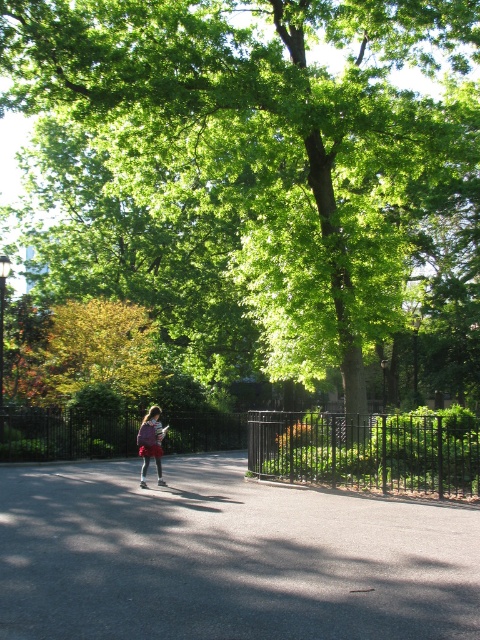
Question: Estimate the real-world distances between objects in this image. Which object is farther from the black rubber skate at center?

Choices:
 (A) green leafy tree at center
 (B) black metal fence at lower center
 (C) matte purple backpack at center

Answer: (A)

Question: Can you confirm if smooth asphalt path at center is positioned to the right of matte purple backpack at center?

Choices:
 (A) no
 (B) yes

Answer: (B)

Question: Among these points, which one is nearest to the camera?

Choices:
 (A) pos(144,481)
 (B) pos(201,225)

Answer: (A)

Question: Is the position of black metal fence at center less distant than that of black rubber skate at center?

Choices:
 (A) yes
 (B) no

Answer: (B)

Question: Can you confirm if green leafy tree at center is positioned below black metal fence at lower center?

Choices:
 (A) no
 (B) yes

Answer: (A)

Question: Which point is closer to the camera?

Choices:
 (A) black rubber skate at center
 (B) black metal fence at lower center

Answer: (A)